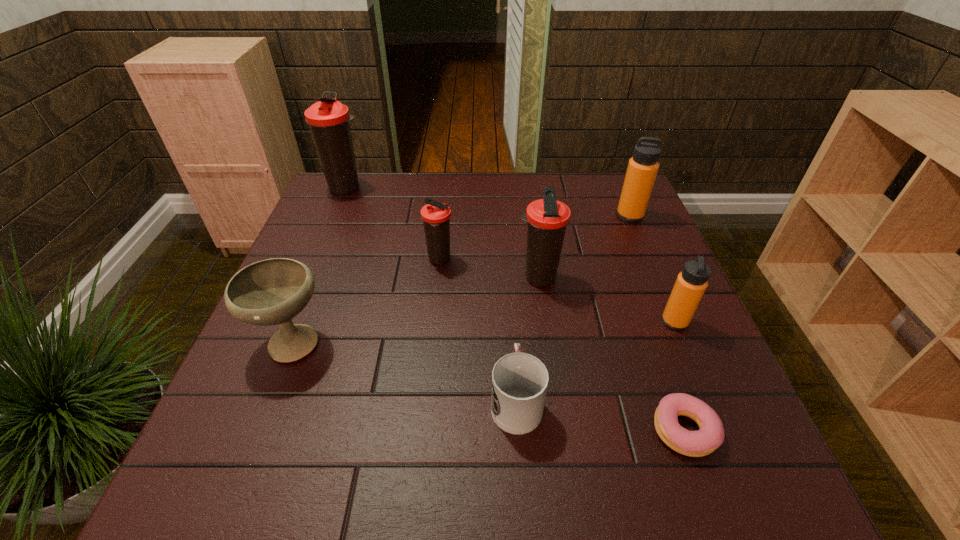
You are a GUI agent. You are given a task and a screenshot of the screen. Output one action in this format:
    pyautogui.click(x=<x>, y=<y>)
    Task: Click on the object at the far right corner
    The width and height of the screenshot is (960, 540).
    Given the screenshot: What is the action you would take?
    pyautogui.click(x=642, y=169)

The image size is (960, 540). I want to click on object that is at the near right corner, so click(x=710, y=436).

In the image, there is a desktop. Where is `vacant region at the far edge`? This screenshot has height=540, width=960. vacant region at the far edge is located at coordinates (460, 205).

I want to click on vacant space at the near edge, so click(x=571, y=458).

Find the location of a particular element. The image size is (960, 540). vacant space at the left edge of the desktop is located at coordinates (295, 431).

You are a GUI agent. You are given a task and a screenshot of the screen. Output one action in this format:
    pyautogui.click(x=<x>, y=<y>)
    Task: Click on the vacant space at the right edge of the desktop
    
    Given the screenshot: What is the action you would take?
    pyautogui.click(x=627, y=324)

The image size is (960, 540). I want to click on free point at the far left corner, so click(346, 203).

The image size is (960, 540). In order to click on free space at the near left corner of the desktop in this screenshot , I will do click(x=226, y=473).

Locate an element on the screen. The image size is (960, 540). vacant area at the far right corner of the desktop is located at coordinates (600, 193).

In order to click on free space that is in between the pink doughnut and the leftmost thermos bottle in this screenshot , I will do `click(516, 308)`.